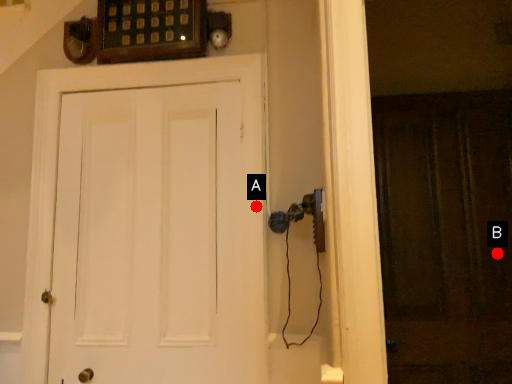
Question: Two points are circled on the image, labeled by A and B beside each circle. Which point appears closest to the camera in this image?

Choices:
 (A) A is closer
 (B) B is closer

Answer: (A)